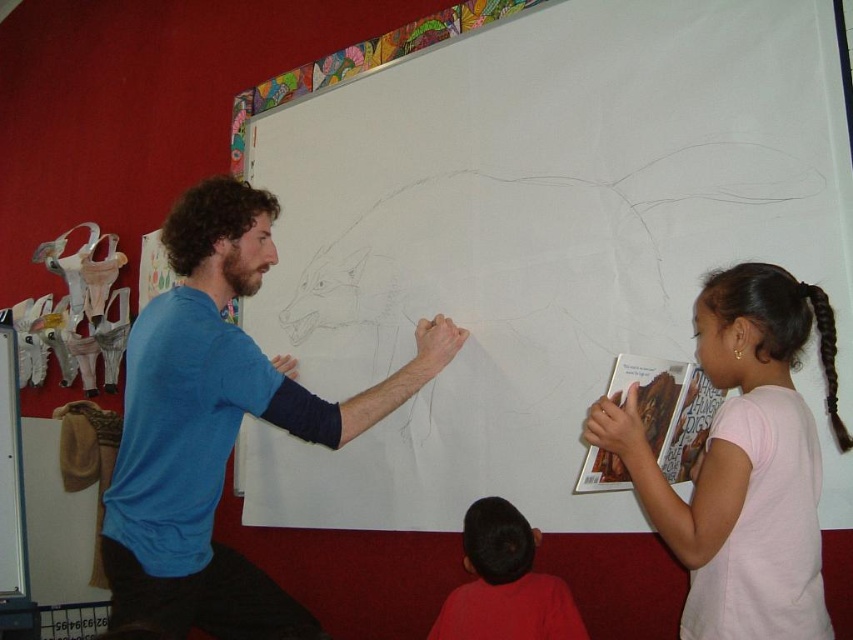
Question: Which point is farther to the camera?

Choices:
 (A) tap(830, 365)
 (B) tap(254, 280)
 (C) tap(480, 596)
 (D) tap(694, 301)

Answer: (B)

Question: Which point is closer to the camera?

Choices:
 (A) (825, 310)
 (B) (520, 618)
 (C) (173, 460)

Answer: (A)

Question: Is white paper at upper center bigger than smooth red shirt at lower center?

Choices:
 (A) yes
 (B) no

Answer: (A)

Question: Which object appears closest to the camera in this image?

Choices:
 (A) blue cotton shirt at center
 (B) white paper at upper center
 (C) black braided hair at upper right

Answer: (A)

Question: Can you confirm if pink cotton shirt at right is positioned to the right of smooth red shirt at lower center?

Choices:
 (A) no
 (B) yes

Answer: (B)

Question: Does white paper at upper center appear on the left side of pink cotton shirt at right?

Choices:
 (A) yes
 (B) no

Answer: (A)